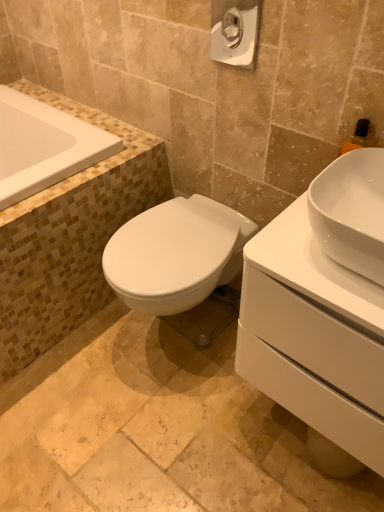
Question: Do you think white glossy sink at right is within white glossy bathtub at upper left, or outside of it?

Choices:
 (A) inside
 (B) outside

Answer: (B)

Question: From their relative heights in the image, would you say white glossy sink at right is taller or shorter than white glossy bathtub at upper left?

Choices:
 (A) short
 (B) tall

Answer: (B)

Question: Which of these objects is positioned closest to the white glossy sink at right?

Choices:
 (A) white glossy sink at right
 (B) white glossy bathtub at upper left
 (C) white glossy toilet paper at upper center

Answer: (A)

Question: Estimate the real-world distances between objects in this image. Which object is farther from the white glossy bathtub at upper left?

Choices:
 (A) white glossy toilet paper at upper center
 (B) white glossy sink at right
 (C) white glossy sink at right

Answer: (B)